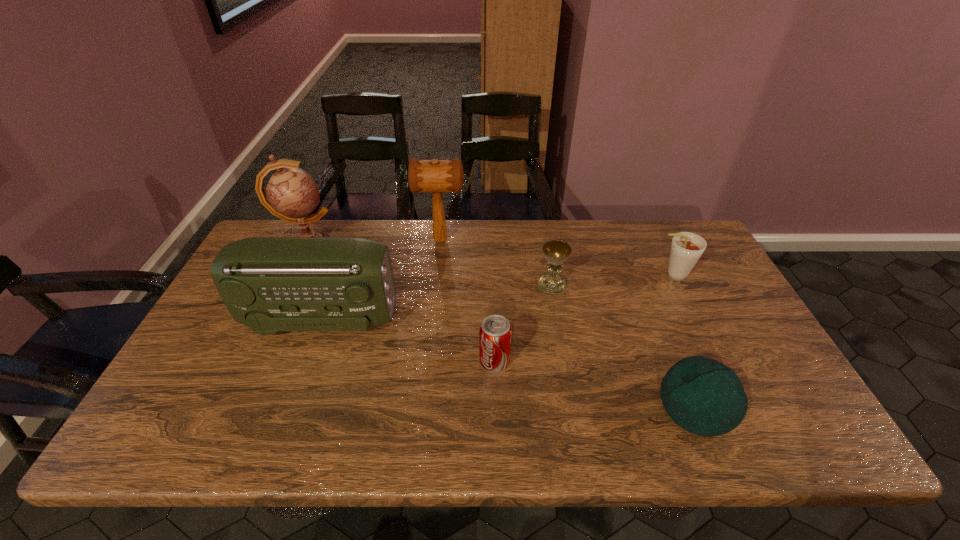
Locate an element on the screen. The width and height of the screenshot is (960, 540). globe is located at coordinates (291, 194).

At what (x,y) coordinates should I click in order to perform the action: click on mallet. Please return your answer as a coordinate pair (x, y). Looking at the image, I should click on (436, 176).

The height and width of the screenshot is (540, 960). I want to click on radio_receiver, so click(x=270, y=284).

Where is `the fifth farthest object`? the fifth farthest object is located at coordinates (270, 284).

Image resolution: width=960 pixels, height=540 pixels. I want to click on root beer, so click(x=686, y=249).

Locate an element on the screen. the fifth object from left to right is located at coordinates (556, 252).

At what (x,y) coordinates should I click in order to perform the action: click on the fourth object from right to left. Please return your answer as a coordinate pair (x, y). The image size is (960, 540). Looking at the image, I should click on (495, 332).

The width and height of the screenshot is (960, 540). I want to click on the second nearest object, so click(495, 332).

This screenshot has height=540, width=960. In order to click on beanie in this screenshot , I will do pyautogui.click(x=703, y=396).

Locate an element on the screen. The image size is (960, 540). free point located on the front-facing side of the globe is located at coordinates (373, 248).